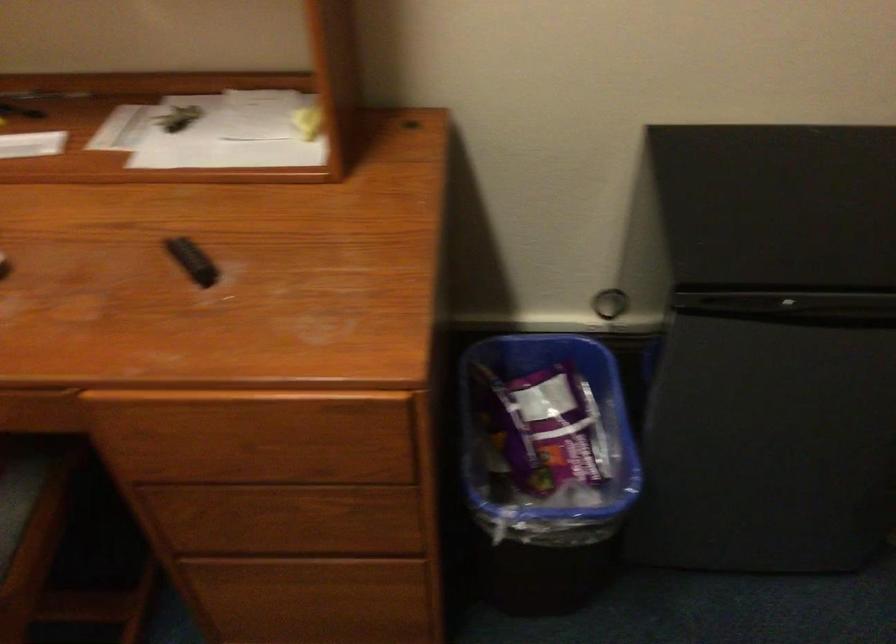
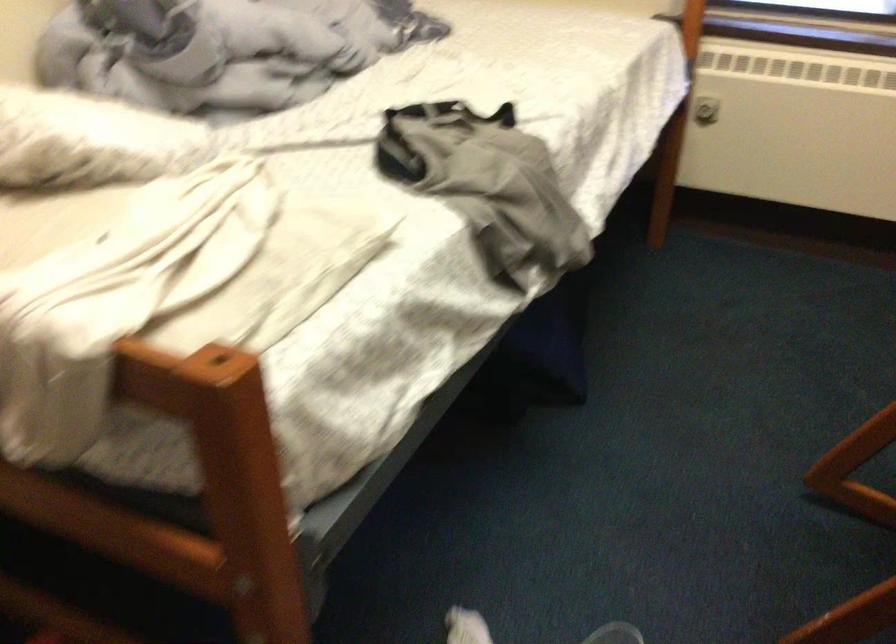
Based on the continuous images, in which direction is the camera rotating?

The camera rotated toward left-down.